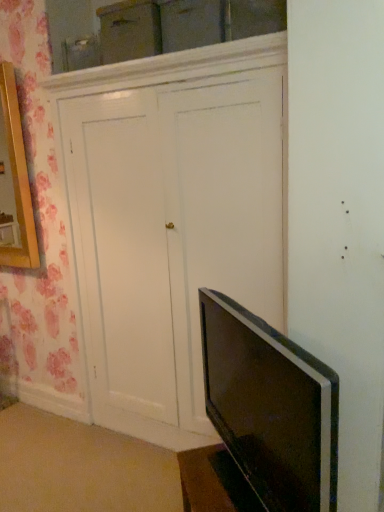
You are a GUI agent. You are given a task and a screenshot of the screen. Output one action in this format:
    pyautogui.click(x=<x>, y=<y>)
    Task: Click on the matte black tv at lower right
    
    Given the screenshot: What is the action you would take?
    pyautogui.click(x=270, y=407)

Describe the element at coordinates (270, 407) in the screenshot. I see `matte black tv at lower right` at that location.

Image resolution: width=384 pixels, height=512 pixels. Identify the location of matte black tv at lower right. (270, 407).